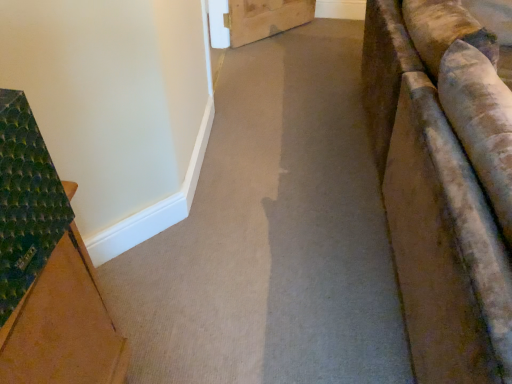
Question: Should I look upward or downward to see carpet at center?

Choices:
 (A) up
 (B) down

Answer: (A)

Question: Can you confirm if green textured mat at left is bigger than carpet at center?

Choices:
 (A) no
 (B) yes

Answer: (A)

Question: Does green textured mat at left have a greater width compared to carpet at center?

Choices:
 (A) yes
 (B) no

Answer: (B)

Question: Can you confirm if green textured mat at left is positioned to the right of carpet at center?

Choices:
 (A) yes
 (B) no

Answer: (B)

Question: Could carpet at center be considered to be inside green textured mat at left?

Choices:
 (A) no
 (B) yes

Answer: (A)

Question: From a real-world perspective, is green textured mat at left physically below carpet at center?

Choices:
 (A) yes
 (B) no

Answer: (B)

Question: Are green textured mat at left and carpet at center far apart?

Choices:
 (A) yes
 (B) no

Answer: (B)

Question: Can you confirm if carpet at center is wider than green textured mat at left?

Choices:
 (A) no
 (B) yes

Answer: (B)

Question: Are carpet at center and green textured mat at left beside each other?

Choices:
 (A) no
 (B) yes

Answer: (A)

Question: From a real-world perspective, is carpet at center physically above green textured mat at left?

Choices:
 (A) no
 (B) yes

Answer: (A)

Question: Is carpet at center smaller than green textured mat at left?

Choices:
 (A) yes
 (B) no

Answer: (B)

Question: Does carpet at center have a lesser height compared to green textured mat at left?

Choices:
 (A) no
 (B) yes

Answer: (B)

Question: Does carpet at center come behind green textured mat at left?

Choices:
 (A) no
 (B) yes

Answer: (B)

Question: Considering the relative positions of green textured mat at left and carpet at center in the image provided, is green textured mat at left to the left or to the right of carpet at center?

Choices:
 (A) left
 (B) right

Answer: (A)